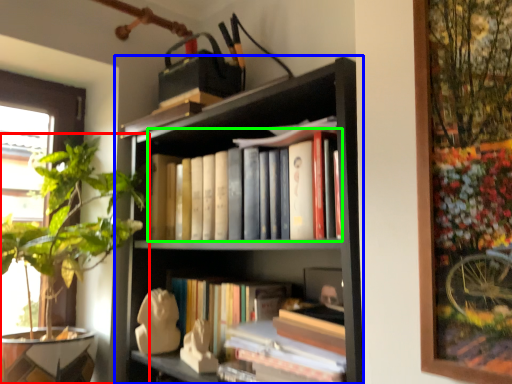
Question: Based on their relative distances, which object is farther from houseplant (highlighted by a red box)? Choose from bookcase (highlighted by a blue box) and book (highlighted by a green box).

Choices:
 (A) bookcase
 (B) book

Answer: (A)